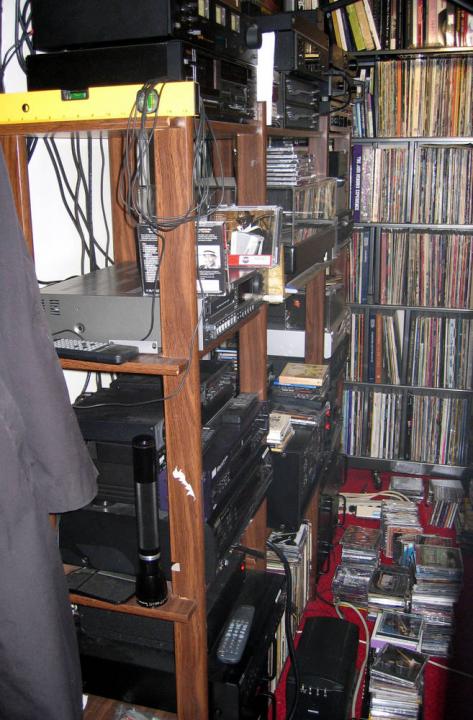
This screenshot has width=473, height=720. Identify the location of glass case. (302, 204).